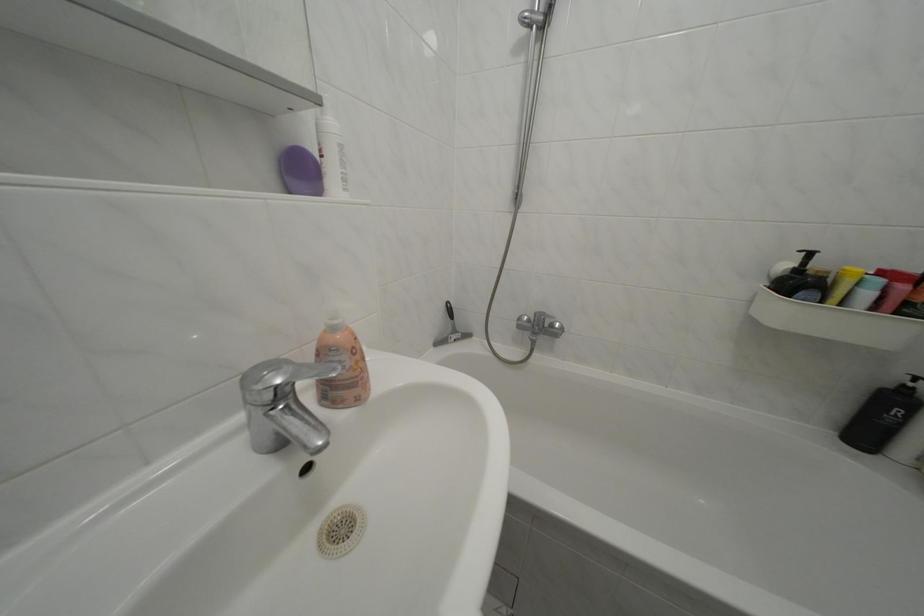
This screenshot has width=924, height=616. What do you see at coordinates (300, 171) in the screenshot?
I see `the purple plastic object` at bounding box center [300, 171].